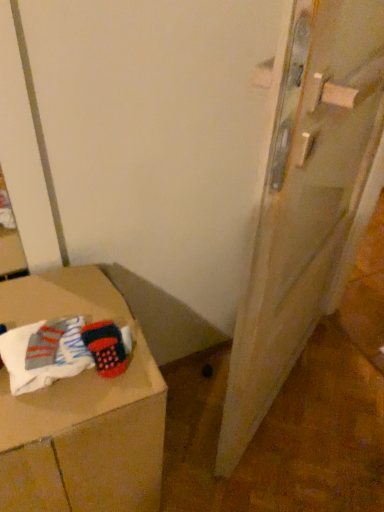
The image size is (384, 512). I want to click on vacant space behind white cotton socks at lower left, so click(67, 300).